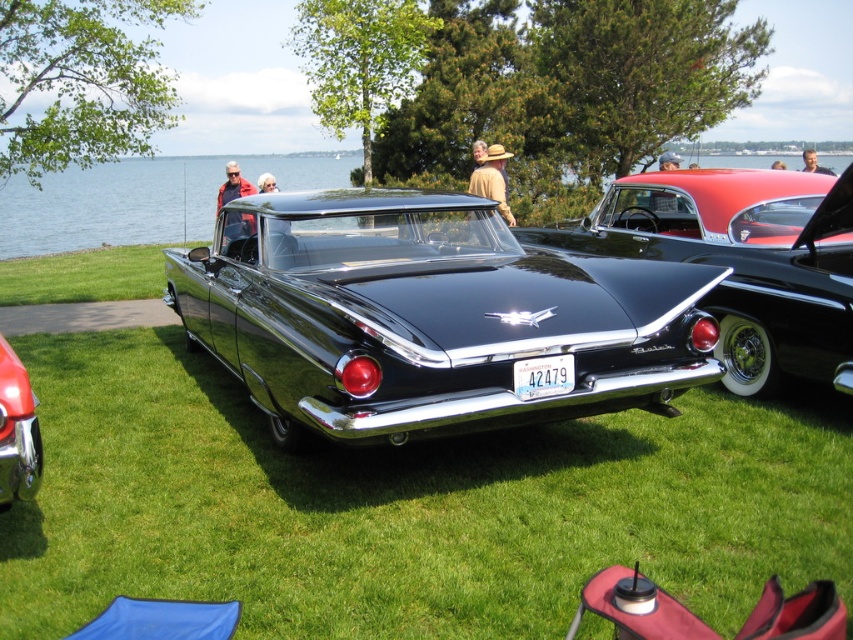
Is glossy black car at center below white plastic license plate at center?

No.

Find the location of a particular element. glossy black car at center is located at coordinates (743, 260).

Does shiny red car at lower left have a greater width compared to white plastic license plate at center?

Correct, the width of shiny red car at lower left exceeds that of white plastic license plate at center.

Who is shorter, shiny red car at lower left or white plastic license plate at center?

With less height is white plastic license plate at center.

Does point (35, 404) lie in front of point (537, 387)?

Yes, point (35, 404) is in front of point (537, 387).

Image resolution: width=853 pixels, height=640 pixels. In order to click on shiny red car at lower left in this screenshot , I will do [16, 432].

Who is taller, black glossy car at center or glossy black car at center?

With more height is glossy black car at center.

In the scene shown: Is black glossy car at center smaller than glossy black car at center?

Incorrect, black glossy car at center is not smaller in size than glossy black car at center.

Who is more forward, (329,400) or (798,296)?

Point (329,400) is more forward.

You are a GUI agent. You are given a task and a screenshot of the screen. Output one action in this format:
    pyautogui.click(x=<x>, y=<y>)
    Task: Click on the black glossy car at center
    This screenshot has height=640, width=853.
    Given the screenshot: What is the action you would take?
    pyautogui.click(x=427, y=316)